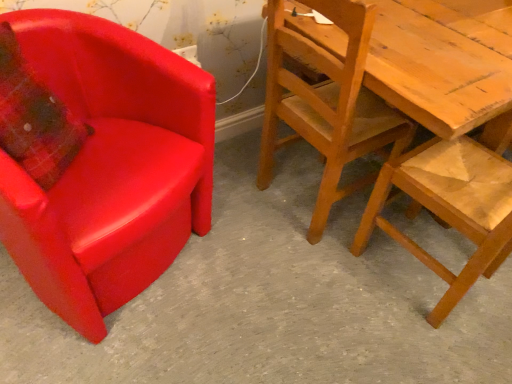
Question: Is matte red armchair at left, the third chair when ordered from right to left, bigger or smaller than wooden chair at right, the second chair positioned from the left?

Choices:
 (A) small
 (B) big

Answer: (B)

Question: Would you say matte red armchair at left, marked as the first chair in a left-to-right arrangement, is to the left or to the right of wooden chair at right, the second chair positioned from the left, in the picture?

Choices:
 (A) left
 (B) right

Answer: (A)

Question: Which object is the farthest from the matte red armchair at left, the third chair when ordered from right to left?

Choices:
 (A) wooden textured chair at right, which ranks as the third chair in left-to-right order
 (B) wooden chair at right, the second chair positioned from the left
 (C) matte plastic chair at left

Answer: (A)

Question: Which object is positioned farthest from the wooden chair at right, the second chair positioned from the left?

Choices:
 (A) matte red armchair at left, marked as the first chair in a left-to-right arrangement
 (B) matte plastic chair at left
 (C) wooden textured chair at right, which is the 1th chair from right to left

Answer: (A)